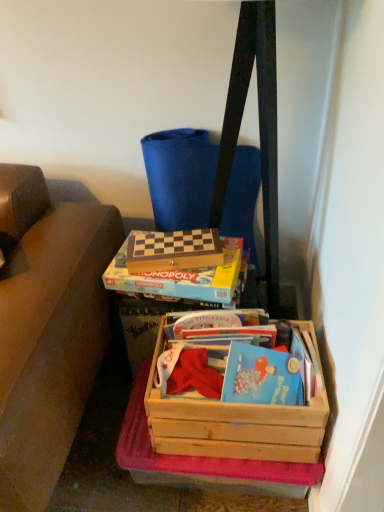
Describe the element at coordinates (174, 251) in the screenshot. I see `wooden chessboard at center, which is the first box from top to bottom` at that location.

Where is `wooden chessboard at center, which is the first box from top to bottom`? wooden chessboard at center, which is the first box from top to bottom is located at coordinates (174, 251).

Locate an element on the screen. This screenshot has height=512, width=384. wooden monopoly game at center, the 2th box positioned from the bottom is located at coordinates (177, 280).

From the picture: Is wooden chessboard at center, which is the first box from top to bottom, not inside wooden crate at lower right, positioned as the first box in bottom-to-top order?

wooden chessboard at center, which is the first box from top to bottom, is positioned outside wooden crate at lower right, positioned as the first box in bottom-to-top order.

Is wooden chessboard at center, which is the first box from top to bottom, aimed at wooden crate at lower right, which is the third box from top to bottom?

No, wooden chessboard at center, which is the first box from top to bottom, is not facing towards wooden crate at lower right, which is the third box from top to bottom.

In the image, is wooden chessboard at center, which is the first box from top to bottom, on the left side or the right side of wooden crate at lower right, positioned as the first box in bottom-to-top order?

From the image, it's evident that wooden chessboard at center, which is the first box from top to bottom, is to the left of wooden crate at lower right, positioned as the first box in bottom-to-top order.

From the image's perspective, would you say wooden chessboard at center, positioned as the 3th box in bottom-to-top order, is shown under wooden crate at lower right, positioned as the first box in bottom-to-top order?

No, from the image's perspective, wooden chessboard at center, positioned as the 3th box in bottom-to-top order, is not below wooden crate at lower right, positioned as the first box in bottom-to-top order.

Looking at this image, is wooden messenger bag at upper center oriented towards wooden monopoly game at center, which appears as the second box when viewed from the top?

Yes, wooden messenger bag at upper center is facing wooden monopoly game at center, which appears as the second box when viewed from the top.

Is wooden messenger bag at upper center to the right of wooden monopoly game at center, which appears as the second box when viewed from the top, from the viewer's perspective?

Indeed, wooden messenger bag at upper center is positioned on the right side of wooden monopoly game at center, which appears as the second box when viewed from the top.

In the image, there is a wooden monopoly game at center, which appears as the second box when viewed from the top. At what (x,y) coordinates should I click in order to perform the action: click on messenger bag below it (from a real-world perspective). Please return your answer as a coordinate pair (x, y). This screenshot has width=384, height=512. Looking at the image, I should click on [x=180, y=177].

In the scene shown: Considering the sizes of objects wooden messenger bag at upper center and wooden monopoly game at center, the 2th box positioned from the bottom, in the image provided, who is taller, wooden messenger bag at upper center or wooden monopoly game at center, the 2th box positioned from the bottom,?

wooden messenger bag at upper center is taller.

Is wooden messenger bag at upper center to the left or to the right of wooden chessboard at center, which is the first box from top to bottom, in the image?

Based on their positions, wooden messenger bag at upper center is located to the right of wooden chessboard at center, which is the first box from top to bottom.

From a real-world perspective, between wooden messenger bag at upper center and wooden chessboard at center, positioned as the 3th box in bottom-to-top order, who is vertically lower?

wooden messenger bag at upper center.

How different are the orientations of wooden messenger bag at upper center and wooden chessboard at center, positioned as the 3th box in bottom-to-top order, in degrees?

wooden messenger bag at upper center and wooden chessboard at center, positioned as the 3th box in bottom-to-top order, are facing 11.8 degrees away from each other.

Considering the relative sizes of wooden messenger bag at upper center and wooden chessboard at center, positioned as the 3th box in bottom-to-top order, in the image provided, is wooden messenger bag at upper center smaller than wooden chessboard at center, positioned as the 3th box in bottom-to-top order,?

No.

Is point (226, 297) closer or farther from the camera than point (164, 236)?

Point (226, 297) is closer to the camera than point (164, 236).

Considering the sizes of objects wooden monopoly game at center, which appears as the second box when viewed from the top, and wooden chessboard at center, positioned as the 3th box in bottom-to-top order, in the image provided, who is taller, wooden monopoly game at center, which appears as the second box when viewed from the top, or wooden chessboard at center, positioned as the 3th box in bottom-to-top order,?

Standing taller between the two is wooden monopoly game at center, which appears as the second box when viewed from the top.

Is wooden monopoly game at center, the 2th box positioned from the bottom, not within wooden chessboard at center, positioned as the 3th box in bottom-to-top order?

wooden monopoly game at center, the 2th box positioned from the bottom, lies outside wooden chessboard at center, positioned as the 3th box in bottom-to-top order,'s area.

Looking at their sizes, would you say wooden monopoly game at center, the 2th box positioned from the bottom, is wider or thinner than wooden chessboard at center, positioned as the 3th box in bottom-to-top order?

Considering their sizes, wooden monopoly game at center, the 2th box positioned from the bottom, looks broader than wooden chessboard at center, positioned as the 3th box in bottom-to-top order.

Which is more to the left, wooden chessboard at center, which is the first box from top to bottom, or wooden monopoly game at center, the 2th box positioned from the bottom?

From the viewer's perspective, wooden chessboard at center, which is the first box from top to bottom, appears more on the left side.

From the image's perspective, between wooden chessboard at center, which is the first box from top to bottom, and wooden monopoly game at center, the 2th box positioned from the bottom, which one is located above?

wooden chessboard at center, which is the first box from top to bottom, is shown above in the image.

How far apart are wooden chessboard at center, which is the first box from top to bottom, and wooden monopoly game at center, the 2th box positioned from the bottom?

5.62 centimeters.

Choose the correct answer: Is wooden chessboard at center, positioned as the 3th box in bottom-to-top order, inside wooden monopoly game at center, the 2th box positioned from the bottom, or outside it?

wooden chessboard at center, positioned as the 3th box in bottom-to-top order, is outside wooden monopoly game at center, the 2th box positioned from the bottom.

From the image's perspective, which object appears higher, wooden crate at lower right, positioned as the first box in bottom-to-top order, or wooden chessboard at center, which is the first box from top to bottom?

wooden chessboard at center, which is the first box from top to bottom, appears higher in the image.

Considering the relative sizes of wooden crate at lower right, positioned as the first box in bottom-to-top order, and wooden chessboard at center, positioned as the 3th box in bottom-to-top order, in the image provided, is wooden crate at lower right, positioned as the first box in bottom-to-top order, shorter than wooden chessboard at center, positioned as the 3th box in bottom-to-top order,?

No, wooden crate at lower right, positioned as the first box in bottom-to-top order, is not shorter than wooden chessboard at center, positioned as the 3th box in bottom-to-top order.

Considering the sizes of objects wooden crate at lower right, positioned as the first box in bottom-to-top order, and wooden chessboard at center, which is the first box from top to bottom, in the image provided, who is smaller, wooden crate at lower right, positioned as the first box in bottom-to-top order, or wooden chessboard at center, which is the first box from top to bottom,?

Smaller between the two is wooden chessboard at center, which is the first box from top to bottom.

Visually, is wooden crate at lower right, which is the third box from top to bottom, positioned to the left or to the right of wooden chessboard at center, positioned as the 3th box in bottom-to-top order?

wooden crate at lower right, which is the third box from top to bottom, is to the right of wooden chessboard at center, positioned as the 3th box in bottom-to-top order.

Is wooden crate at lower right, positioned as the first box in bottom-to-top order, next to wooden messenger bag at upper center and touching it?

wooden crate at lower right, positioned as the first box in bottom-to-top order, is not next to wooden messenger bag at upper center, and they're not touching.

Can you confirm if wooden crate at lower right, positioned as the first box in bottom-to-top order, is bigger than wooden messenger bag at upper center?

No, wooden crate at lower right, positioned as the first box in bottom-to-top order, is not bigger than wooden messenger bag at upper center.

Consider the image. Considering the sizes of objects wooden crate at lower right, positioned as the first box in bottom-to-top order, and wooden messenger bag at upper center in the image provided, who is thinner, wooden crate at lower right, positioned as the first box in bottom-to-top order, or wooden messenger bag at upper center?

Thinner between the two is wooden messenger bag at upper center.

From the image's perspective, which box is the 2nd one below the wooden chessboard at center, positioned as the 3th box in bottom-to-top order? Please provide its 2D coordinates.

[(236, 421)]

Starting from the wooden messenger bag at upper center, which box is the 1st one to the left? Please provide its 2D coordinates.

[(177, 280)]

Based on their spatial positions, is wooden chessboard at center, positioned as the 3th box in bottom-to-top order, or wooden messenger bag at upper center closer to wooden monopoly game at center, which appears as the second box when viewed from the top?

wooden chessboard at center, positioned as the 3th box in bottom-to-top order, is positioned closer to the anchor wooden monopoly game at center, which appears as the second box when viewed from the top.

Considering their positions, is wooden crate at lower right, positioned as the first box in bottom-to-top order, positioned further to wooden chessboard at center, positioned as the 3th box in bottom-to-top order, than wooden monopoly game at center, the 2th box positioned from the bottom?

wooden crate at lower right, positioned as the first box in bottom-to-top order, is further to wooden chessboard at center, positioned as the 3th box in bottom-to-top order.

Looking at the image, which one is located further to wooden messenger bag at upper center, wooden chessboard at center, which is the first box from top to bottom, or wooden monopoly game at center, the 2th box positioned from the bottom?

Based on the image, wooden monopoly game at center, the 2th box positioned from the bottom, appears to be further to wooden messenger bag at upper center.

Estimate the real-world distances between objects in this image. Which object is closer to wooden monopoly game at center, which appears as the second box when viewed from the top, wooden chessboard at center, positioned as the 3th box in bottom-to-top order, or wooden crate at lower right, positioned as the first box in bottom-to-top order?

wooden chessboard at center, positioned as the 3th box in bottom-to-top order, is closer to wooden monopoly game at center, which appears as the second box when viewed from the top.

Considering their positions, is wooden monopoly game at center, the 2th box positioned from the bottom, positioned further to wooden crate at lower right, which is the third box from top to bottom, than wooden messenger bag at upper center?

Among the two, wooden messenger bag at upper center is located further to wooden crate at lower right, which is the third box from top to bottom.

Estimate the real-world distances between objects in this image. Which object is further from wooden chessboard at center, which is the first box from top to bottom, wooden messenger bag at upper center or wooden monopoly game at center, which appears as the second box when viewed from the top?

wooden messenger bag at upper center is positioned further to the anchor wooden chessboard at center, which is the first box from top to bottom.

When comparing their distances from wooden chessboard at center, which is the first box from top to bottom, does wooden messenger bag at upper center or wooden crate at lower right, which is the third box from top to bottom, seem closer?

wooden messenger bag at upper center.

Consider the image. When comparing their distances from wooden monopoly game at center, which appears as the second box when viewed from the top, does wooden messenger bag at upper center or wooden chessboard at center, which is the first box from top to bottom, seem closer?

Among the two, wooden chessboard at center, which is the first box from top to bottom, is located nearer to wooden monopoly game at center, which appears as the second box when viewed from the top.

You are a GUI agent. You are given a task and a screenshot of the screen. Output one action in this format:
    pyautogui.click(x=<x>, y=<y>)
    Task: Click on the box between wooden chessboard at center, which is the first box from top to bottom, and wooden crate at lower right, positioned as the first box in bottom-to-top order, in the up-down direction
    Image resolution: width=384 pixels, height=512 pixels.
    Given the screenshot: What is the action you would take?
    pyautogui.click(x=177, y=280)

At what (x,y) coordinates should I click in order to perform the action: click on box that lies between wooden messenger bag at upper center and wooden monopoly game at center, the 2th box positioned from the bottom, from top to bottom. Please return your answer as a coordinate pair (x, y). Looking at the image, I should click on (174, 251).